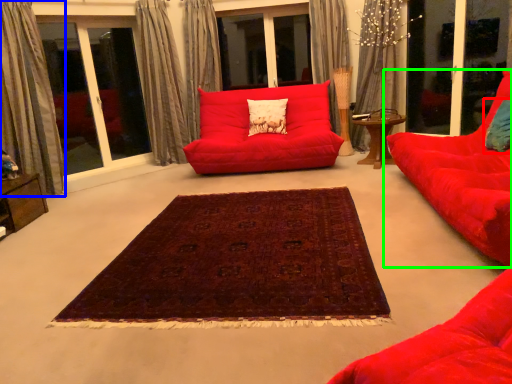
Question: Based on their relative distances, which object is nearer to pillow (highlighted by a red box)? Choose from curtain (highlighted by a blue box) and studio couch (highlighted by a green box).

Choices:
 (A) curtain
 (B) studio couch

Answer: (B)